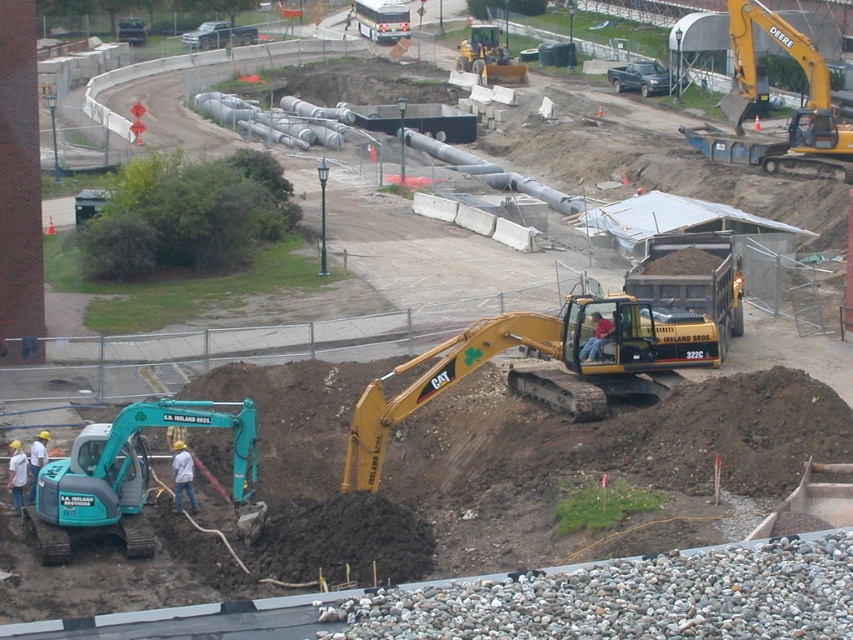
Does brown soil at lower left have a smaller size compared to teal rubber excavator at lower left?

No.

Is point (606, 464) more distant than point (33, 508)?

Yes, point (606, 464) is behind point (33, 508).

Does point (276, 380) lie in front of point (53, 472)?

No, (276, 380) is behind (53, 472).

You are a GUI agent. You are given a task and a screenshot of the screen. Output one action in this format:
    pyautogui.click(x=<x>, y=<y>)
    Task: Click on the brown soil at lower left
    
    Given the screenshot: What is the action you would take?
    pyautogui.click(x=521, y=456)

Who is positioned more to the left, teal rubber excavator at lower left or light blue jeans at lower left?

From the viewer's perspective, teal rubber excavator at lower left appears more on the left side.

Is teal rubber excavator at lower left positioned before light blue jeans at lower left?

Yes, it is in front of light blue jeans at lower left.

I want to click on teal rubber excavator at lower left, so click(126, 474).

Which is more to the right, teal rubber excavator at lower left or yellow rubber excavator at upper right?

From the viewer's perspective, yellow rubber excavator at upper right appears more on the right side.

At what (x,y) coordinates should I click in order to perform the action: click on teal rubber excavator at lower left. Please return your answer as a coordinate pair (x, y). Image resolution: width=853 pixels, height=640 pixels. Looking at the image, I should click on (126, 474).